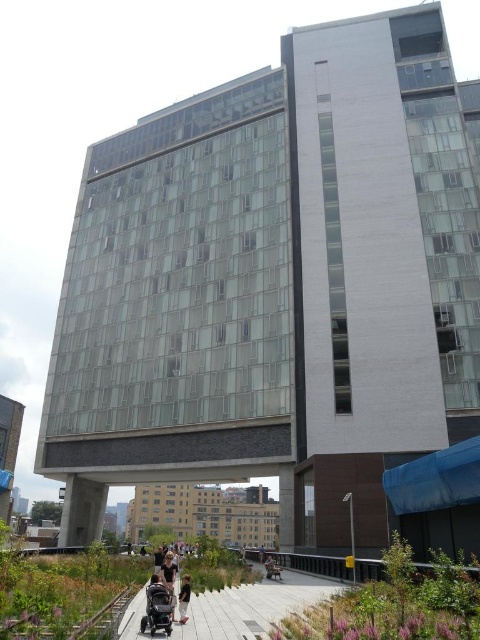
You are a delivery person trying to place a light brown leather jacket at lower center on the concrete walkway at lower center. Considering the dimensions provided, will the jacket fit entirely on the walkway without overhanging?

The concrete walkway at lower center is wider than the light brown leather jacket at lower center, so the jacket can be placed entirely on the walkway without overhanging.

You are a delivery person trying to place a package on the walkway in front of the building. You see the light brown leather jacket at lower center and the light brown wooden chair at lower center. Can you tell which item takes up more space so you can choose the larger one to move out of the way?

The light brown wooden chair at lower center occupies more space than the light brown leather jacket at lower center, so you should move the light brown wooden chair at lower center to make room for the package.